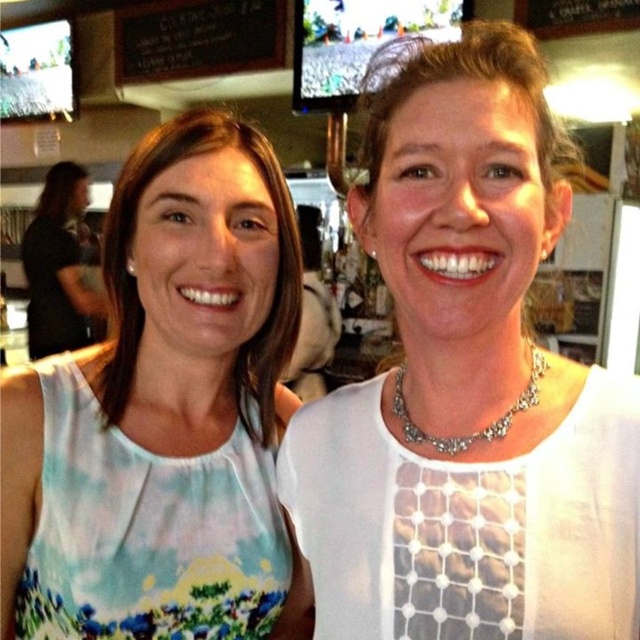
Question: Is white textured blouse at center to the left of blue tie-dye tank top at left from the viewer's perspective?

Choices:
 (A) yes
 (B) no

Answer: (B)

Question: Is white textured blouse at center positioned before black chalkboard at upper center?

Choices:
 (A) yes
 (B) no

Answer: (A)

Question: Among these points, which one is nearest to the camera?

Choices:
 (A) (506, 416)
 (B) (465, 483)
 (C) (68, 179)
 (D) (88, 372)

Answer: (B)

Question: Which of the following is the closest to the observer?

Choices:
 (A) blue tie-dye tank top at left
 (B) matte black shirt at left
 (C) black chalkboard at upper center
 (D) white textured blouse at center

Answer: (D)

Question: Which point is closer to the camera?

Choices:
 (A) (28, 580)
 (B) (83, 292)

Answer: (A)

Question: Can you confirm if blue tie-dye tank top at left is positioned to the left of black chalkboard at upper center?

Choices:
 (A) no
 (B) yes

Answer: (A)